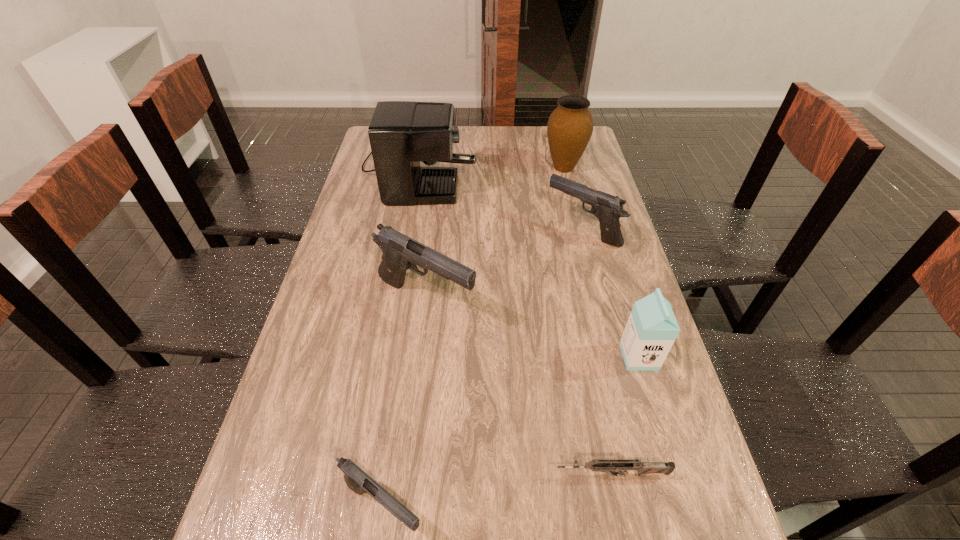
The image size is (960, 540). In order to click on free space located 0.230m on the front-facing side of the black coffee maker in this screenshot , I will do `click(540, 166)`.

Where is `free space located on the left of the brown urn`? The width and height of the screenshot is (960, 540). free space located on the left of the brown urn is located at coordinates (515, 167).

Identify the location of free spot located at the muzzle of the second nearest black gun. Image resolution: width=960 pixels, height=540 pixels. (545, 301).

The image size is (960, 540). Find the location of `free spot located on the front of the fifth farthest object`. free spot located on the front of the fifth farthest object is located at coordinates (656, 411).

Where is `free spot located at the muzzle of the second smallest black gun`? free spot located at the muzzle of the second smallest black gun is located at coordinates (497, 231).

Where is `vacant point located at the muzzle of the second smallest black gun`? The height and width of the screenshot is (540, 960). vacant point located at the muzzle of the second smallest black gun is located at coordinates (458, 231).

Locate an element on the screen. vacant area situated 0.080m at the muzzle of the second smallest black gun is located at coordinates (520, 231).

This screenshot has width=960, height=540. I want to click on free space located aimed along the barrel of the shortest gun, so click(477, 475).

This screenshot has width=960, height=540. Identify the location of vacant position located aimed along the barrel of the shortest gun. (477, 475).

The width and height of the screenshot is (960, 540). I want to click on vacant space located 0.170m aimed along the barrel of the shortest gun, so point(467,475).